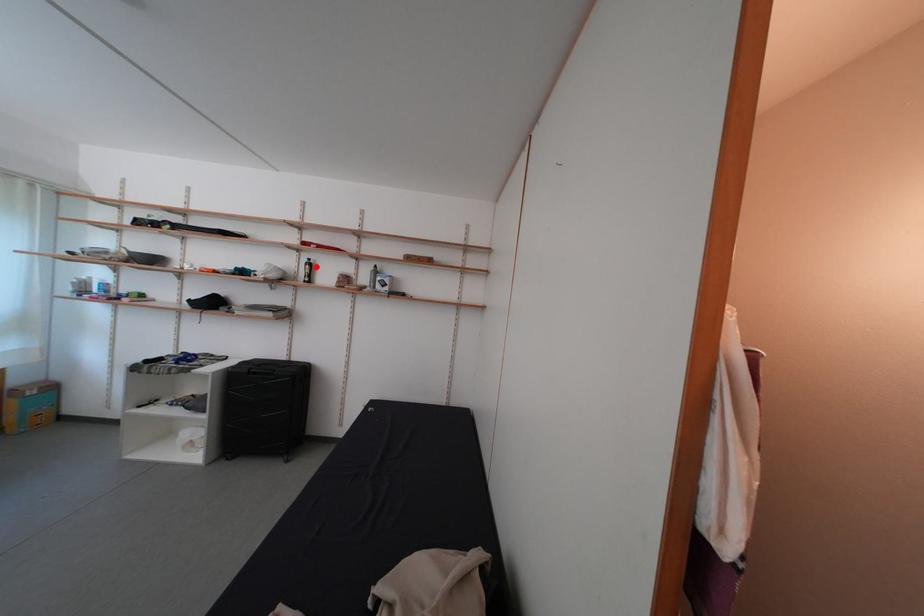
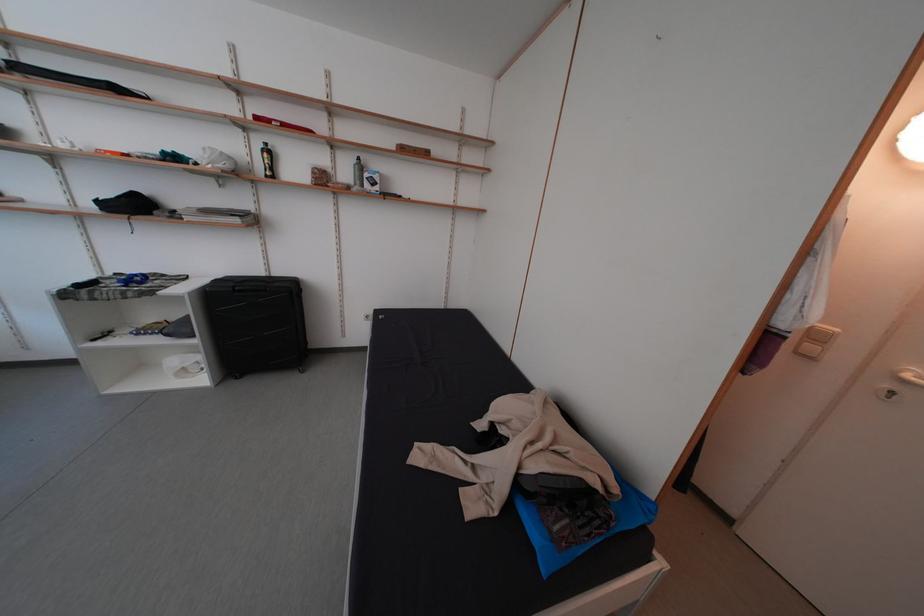
The point at the highlighted location is marked in the first image. Where is the corresponding point in the second image?

(272, 152)